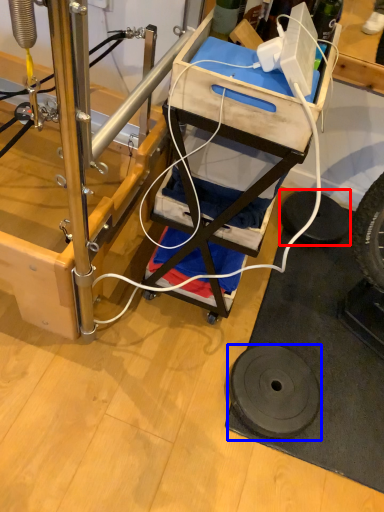
Question: Which point is further to the camera, tire (highlighted by a red box) or wheel (highlighted by a blue box)?

Choices:
 (A) tire
 (B) wheel

Answer: (A)